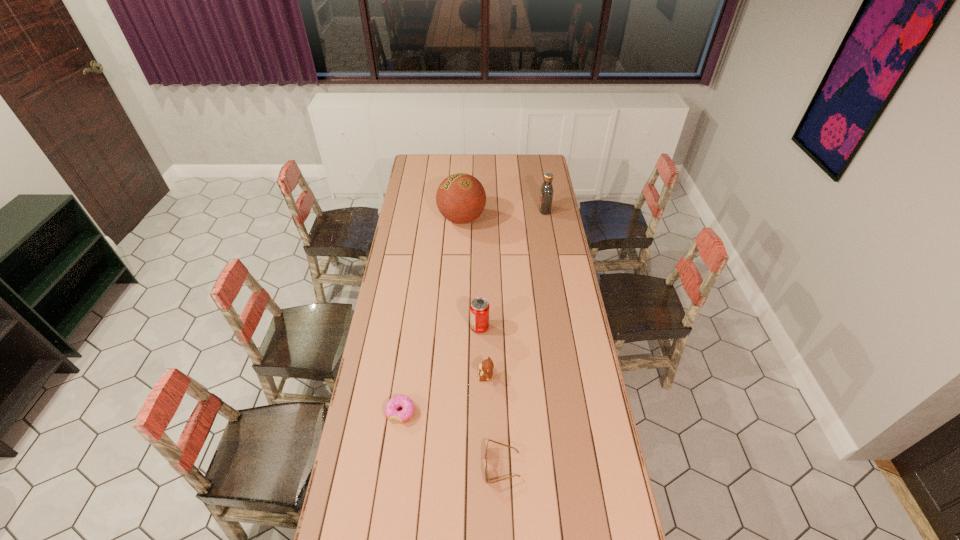
What are the coordinates of `blank space located 0.210m on the left of the basketball` in the screenshot? It's located at (398, 219).

Find the location of a particular element. The width and height of the screenshot is (960, 540). free space located on the front-facing side of the vodka is located at coordinates (503, 210).

You are a GUI agent. You are given a task and a screenshot of the screen. Output one action in this format:
    pyautogui.click(x=<x>, y=<y>)
    Task: Click on the vacant space located 0.100m on the front-facing side of the vodka
    The image size is (960, 540).
    Given the screenshot: What is the action you would take?
    [520, 210]

The width and height of the screenshot is (960, 540). What are the coordinates of `free spot located on the front-facing side of the vodka` in the screenshot? It's located at (499, 210).

Find the location of a particular element. vacant space situated on the front of the soda can is located at coordinates (480, 357).

Locate an element on the screen. This screenshot has width=960, height=540. vacant space situated on the face of the third nearest object is located at coordinates (378, 376).

The width and height of the screenshot is (960, 540). I want to click on free spot located on the face of the third nearest object, so click(449, 376).

Where is `vacant space located on the face of the third nearest object`? This screenshot has width=960, height=540. vacant space located on the face of the third nearest object is located at coordinates (418, 376).

This screenshot has height=540, width=960. In order to click on vacant space located on the back of the doughnut in this screenshot , I will do `click(411, 336)`.

Where is `vacant position located 0.150m on the frames of the nearest object`? This screenshot has width=960, height=540. vacant position located 0.150m on the frames of the nearest object is located at coordinates (440, 465).